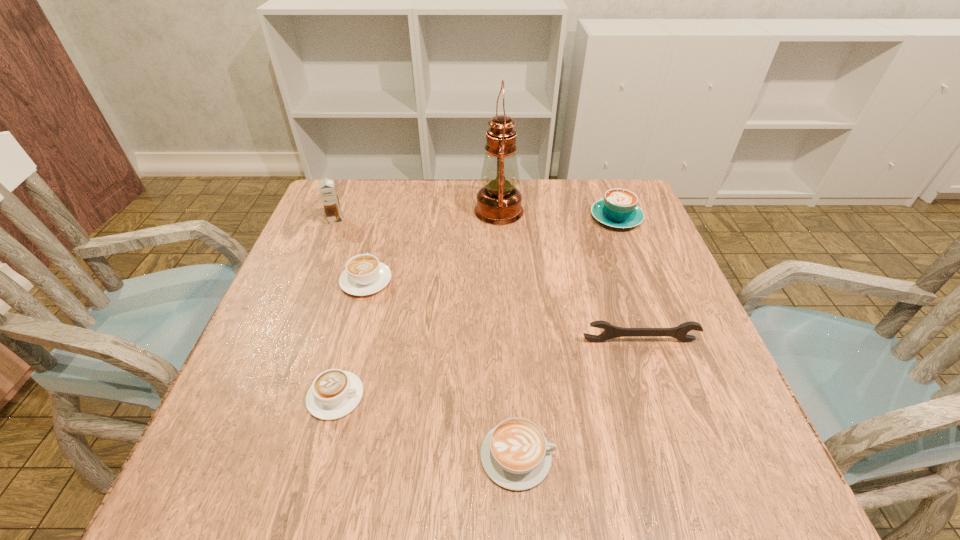
Identify the location of chocolate milk positioned at the far edge. The width and height of the screenshot is (960, 540). (327, 189).

At what (x,y) coordinates should I click in order to perform the action: click on cappuccino that is positioned at the far edge. Please return your answer as a coordinate pair (x, y). Looking at the image, I should click on (618, 209).

Find the location of `object that is at the near edge`. object that is at the near edge is located at coordinates (515, 454).

The height and width of the screenshot is (540, 960). Identify the location of chocolate milk situated at the left edge. (327, 189).

This screenshot has width=960, height=540. What are the coordinates of `cappuccino at the right edge` in the screenshot? It's located at (618, 209).

I want to click on wrench situated at the right edge, so click(x=610, y=331).

I want to click on object that is at the far left corner, so click(x=327, y=189).

You are a GUI agent. You are given a task and a screenshot of the screen. Output one action in this format:
    pyautogui.click(x=<x>, y=<y>)
    Task: Click on the object positioned at the far right corner
    
    Given the screenshot: What is the action you would take?
    pyautogui.click(x=618, y=209)

Find the location of `vacant space at the far edge of the desktop`. vacant space at the far edge of the desktop is located at coordinates (444, 221).

Where is `free location at the near edge`? This screenshot has height=540, width=960. free location at the near edge is located at coordinates (545, 482).